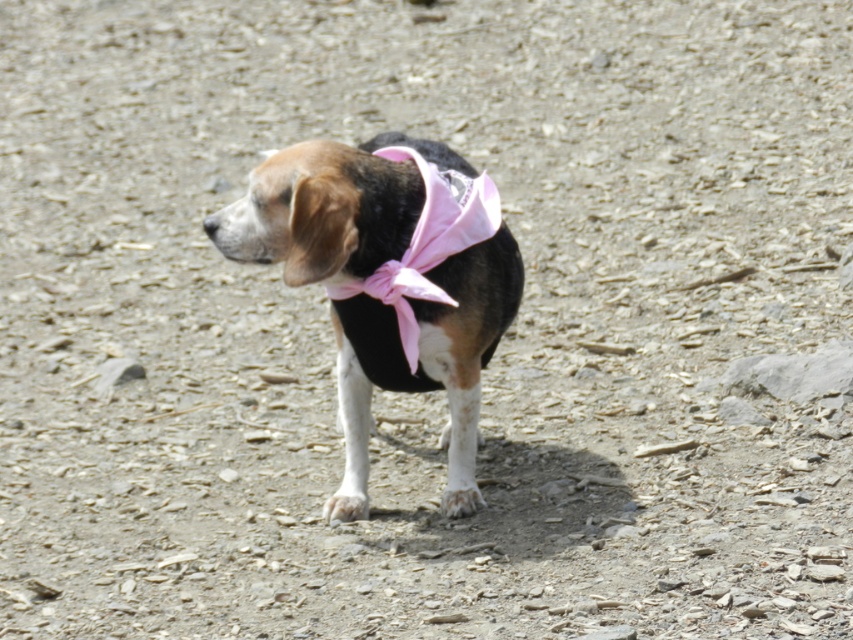
Does point (421, 324) lie behind point (337, 288)?

Yes, it is behind point (337, 288).

The height and width of the screenshot is (640, 853). What do you see at coordinates (425, 364) in the screenshot?
I see `black and white fur dog at center` at bounding box center [425, 364].

Who is more forward, [459,381] or [453,189]?

Positioned in front is point [453,189].

Locate an element on the screen. black and white fur dog at center is located at coordinates (425, 364).